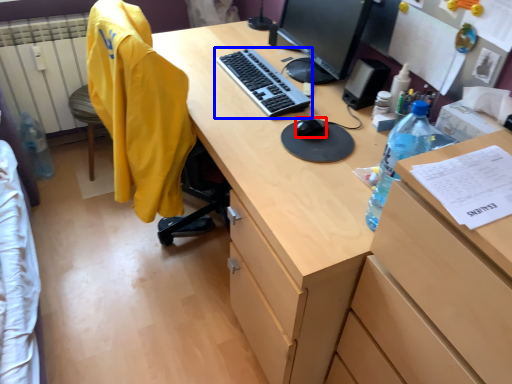
Question: Which object appears closest to the camera in this image, mouse (highlighted by a red box) or computer keyboard (highlighted by a blue box)?

Choices:
 (A) mouse
 (B) computer keyboard

Answer: (A)